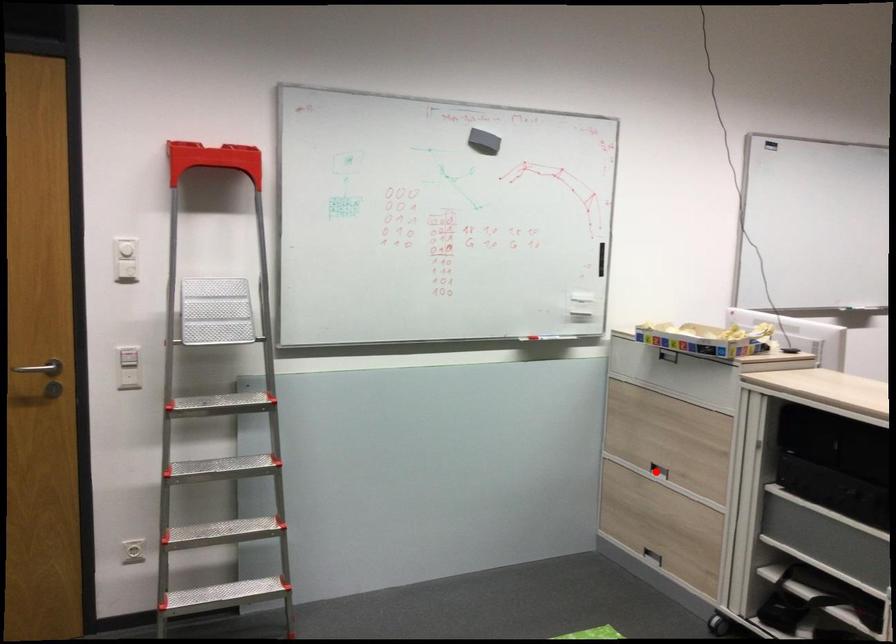
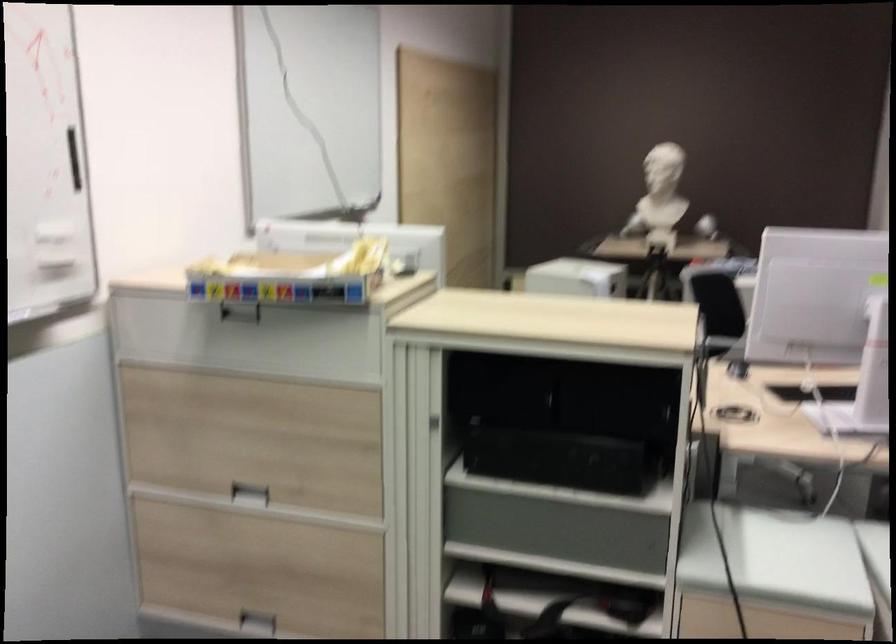
Question: I am providing you with two images of the same scene from different viewpoints. A red point is marked on the first image. Can you still see the location of the red point in image 2?

Choices:
 (A) Yes
 (B) No

Answer: (A)